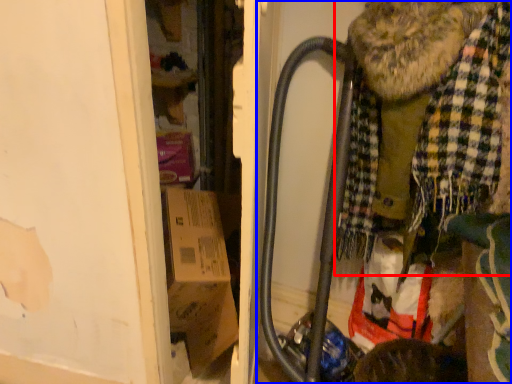
Question: Which object appears farthest to the camera in this image, scarf (highlighted by a red box) or baby carriage (highlighted by a blue box)?

Choices:
 (A) scarf
 (B) baby carriage

Answer: (B)